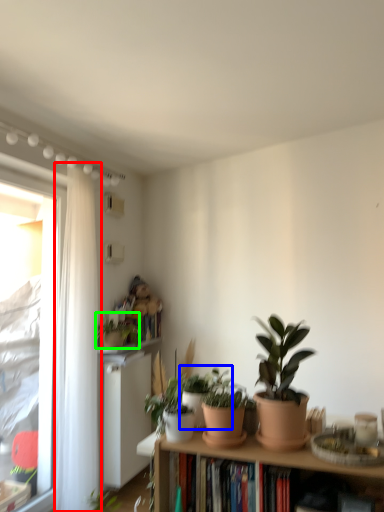
Question: Which object is the farthest from curtain (highlighted by a red box)? Choose among these: houseplant (highlighted by a blue box) or houseplant (highlighted by a green box).

Choices:
 (A) houseplant
 (B) houseplant

Answer: (A)